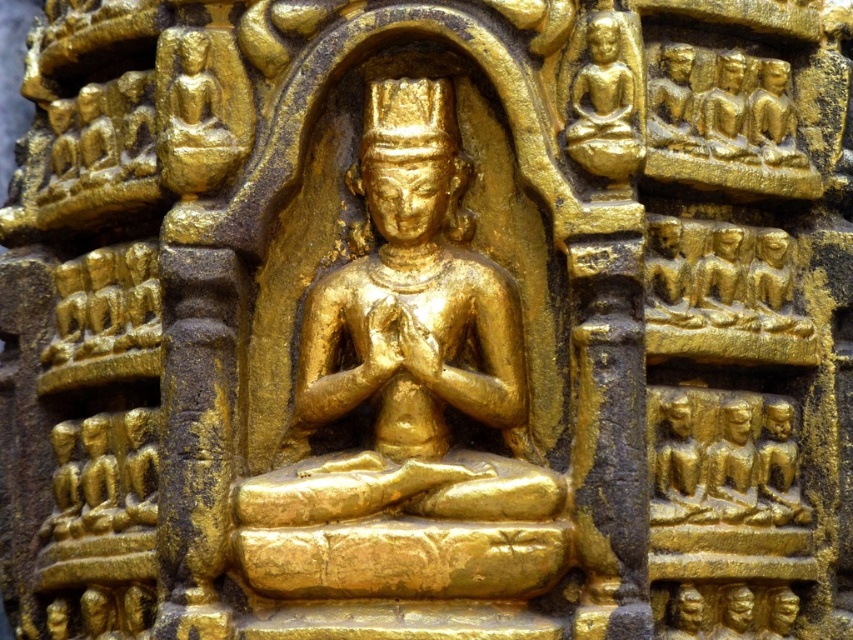
Which is behind, point (421, 554) or point (177, 163)?

Positioned behind is point (177, 163).

You are a GUI agent. You are given a task and a screenshot of the screen. Output one action in this format:
    pyautogui.click(x=<x>, y=<y>)
    Task: Click on the gold polished statue at center
    
    Given the screenshot: What is the action you would take?
    pyautogui.click(x=409, y=394)

Image resolution: width=853 pixels, height=640 pixels. Find the location of `gold polished statue at center`. gold polished statue at center is located at coordinates (409, 394).

Which is behind, point (227, 100) or point (634, 80)?

The point (227, 100) is more distant.

Who is more forward, (189, 122) or (616, 36)?

Positioned in front is point (616, 36).

Where is `gold/gilded statue at upper left`? This screenshot has width=853, height=640. gold/gilded statue at upper left is located at coordinates coord(200,109).

Measure the distance between gold polished statue at center and gold polished statue at upper right.

5.79 inches

Is gold polished statue at center bigger than gold polished statue at upper right?

Yes.

You are a GUI agent. You are given a task and a screenshot of the screen. Output one action in this format:
    pyautogui.click(x=<x>, y=<y>)
    Task: Click on the gold polished statue at center
    The height and width of the screenshot is (640, 853).
    Given the screenshot: What is the action you would take?
    pyautogui.click(x=409, y=394)